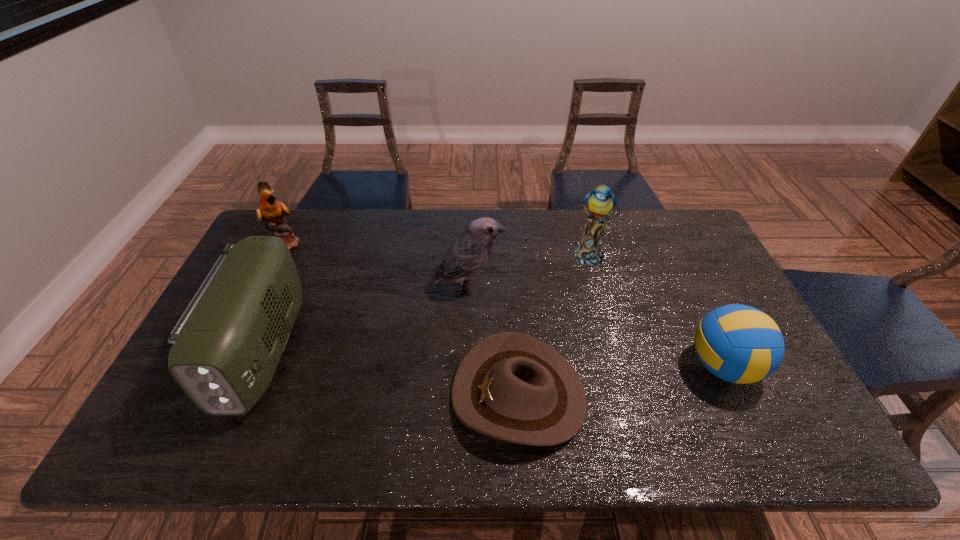
Find the location of a particular element. This screenshot has height=540, width=960. vacant area in the image that satisfies the following two spatial constraints: 1. on the face of the fifth object from left to right; 2. with a star on the front of the shortest object is located at coordinates (627, 395).

Locate an element on the screen. vacant point that satisfies the following two spatial constraints: 1. on the face of the second object from right to left; 2. with a star on the front of the shortest object is located at coordinates (627, 395).

You are a GUI agent. You are given a task and a screenshot of the screen. Output one action in this format:
    pyautogui.click(x=<x>, y=<y>)
    Task: Click on the vacant position in the image that satisfies the following two spatial constraints: 1. on the front-facing side of the second parrot from left to right; 2. on the front-facing side of the radio_receiver
    The height and width of the screenshot is (540, 960).
    Given the screenshot: What is the action you would take?
    pyautogui.click(x=467, y=350)

You are a GUI agent. You are given a task and a screenshot of the screen. Output one action in this format:
    pyautogui.click(x=<x>, y=<y>)
    Task: Click on the free spot that satisfies the following two spatial constraints: 1. on the face of the second object from right to left; 2. with a star on the front of the cowboy hat
    This screenshot has width=960, height=540.
    Given the screenshot: What is the action you would take?
    pyautogui.click(x=627, y=395)

Identify the location of vacant space that satisfies the following two spatial constraints: 1. on the front-facing side of the leftmost parrot; 2. on the left side of the volleyball. (227, 366).

Find the location of a particular element. The width and height of the screenshot is (960, 540). free location that satisfies the following two spatial constraints: 1. on the face of the fifth object from left to right; 2. on the front-facing side of the nearest parrot is located at coordinates (597, 287).

This screenshot has height=540, width=960. What are the coordinates of `vacant space that satisfies the following two spatial constraints: 1. on the front-facing side of the second parrot from left to right; 2. on the front-facing side of the radio_receiver` in the screenshot? It's located at (467, 350).